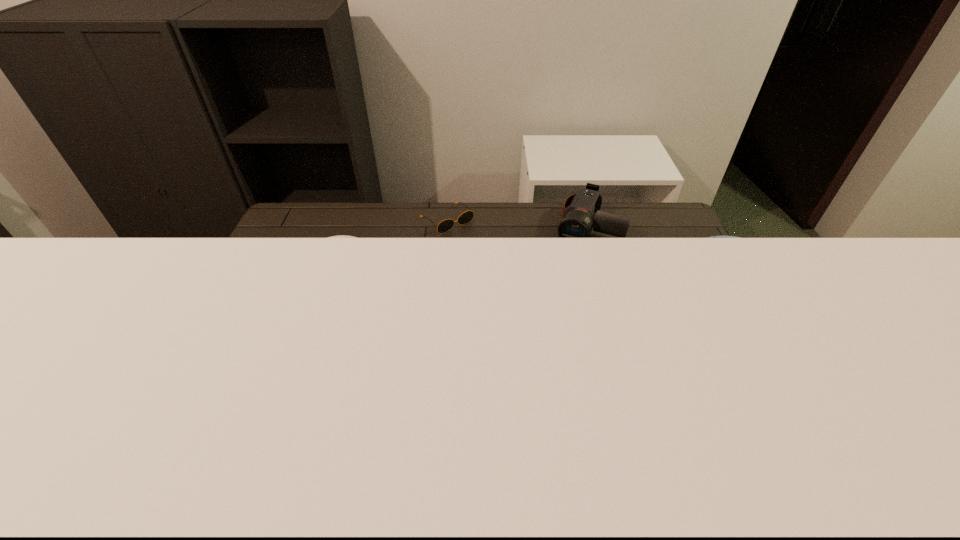
What are the coordinates of `the leftmost object` in the screenshot? It's located at (340, 236).

You are a GUI agent. You are given a task and a screenshot of the screen. Output one action in this format:
    pyautogui.click(x=<x>, y=<y>)
    Task: Click on the right soccer ball
    This screenshot has height=540, width=960.
    Given the screenshot: What is the action you would take?
    pyautogui.click(x=712, y=236)

Image resolution: width=960 pixels, height=540 pixels. Find the location of `the second shortest object`. the second shortest object is located at coordinates (578, 221).

This screenshot has height=540, width=960. In order to click on the third object from right to left in this screenshot , I will do `click(445, 225)`.

Locate an element on the screen. This screenshot has width=960, height=540. the shortest object is located at coordinates (445, 225).

At what (x,y) coordinates should I click in order to perform the action: click on vacant region located on the right of the leftmost object. Please return your answer as a coordinate pair (x, y). Looking at the image, I should click on (503, 321).

The image size is (960, 540). What are the coordinates of `free space located 0.130m on the lens of the second shortest object` in the screenshot? It's located at (566, 272).

You are a GUI agent. You are given a task and a screenshot of the screen. Output one action in this format:
    pyautogui.click(x=<x>, y=<y>)
    Task: Click on the free space located on the lens of the second shortest object
    This screenshot has height=540, width=960.
    Given the screenshot: What is the action you would take?
    pyautogui.click(x=545, y=318)

Locate an element on the screen. The image size is (960, 540). free space located on the lens of the second shortest object is located at coordinates (572, 260).

Image resolution: width=960 pixels, height=540 pixels. In order to click on free space located on the front-facing side of the shortest object in this screenshot , I will do `click(477, 247)`.